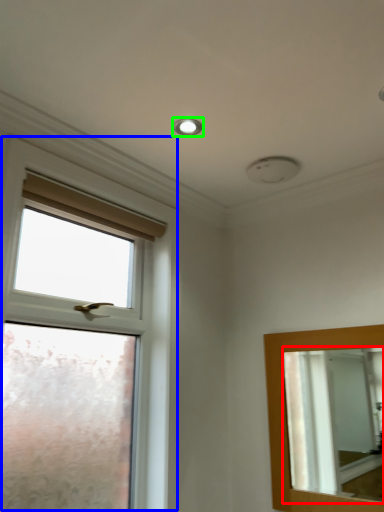
Question: Which object is the closest to the mirror (highlighted by a red box)? Choose among these: window (highlighted by a blue box) or droplight (highlighted by a green box).

Choices:
 (A) window
 (B) droplight

Answer: (A)